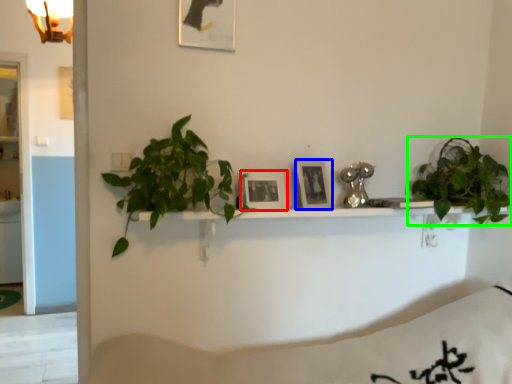
Question: Which object is the farthest from picture frame (highlighted by a red box)? Choose among these: picture frame (highlighted by a blue box) or houseplant (highlighted by a green box).

Choices:
 (A) picture frame
 (B) houseplant

Answer: (B)